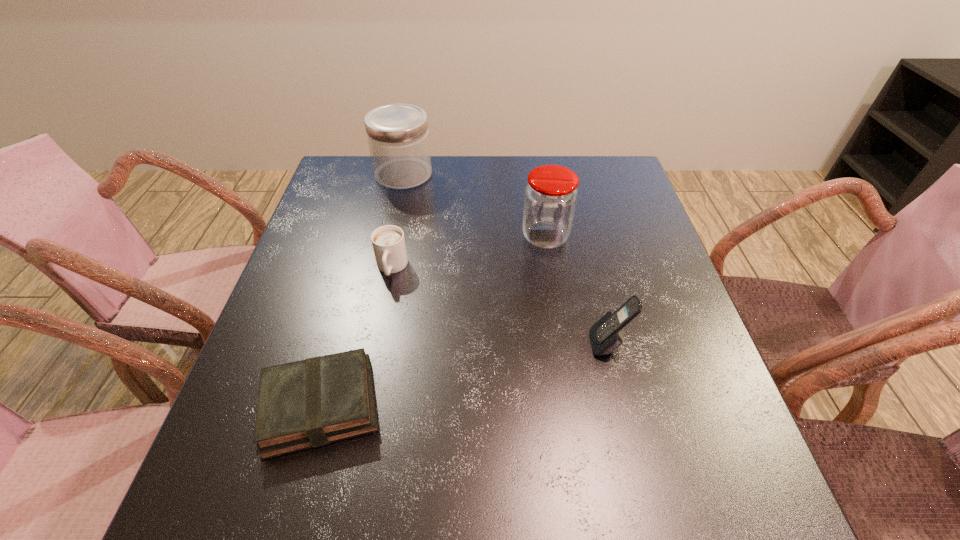
At what (x,y) coordinates should I click in order to perform the action: click on vacant point located between the shortest object and the right jar. Please return your answer as a coordinate pair (x, y). Image resolution: width=960 pixels, height=540 pixels. Looking at the image, I should click on (433, 321).

Locate an element on the screen. empty location between the farther jar and the cellular telephone is located at coordinates (506, 259).

Locate an element on the screen. unoccupied area between the fourth tallest object and the right jar is located at coordinates (468, 253).

At what (x,y) coordinates should I click in order to perform the action: click on free space between the shortest object and the cappuccino. Please return your answer as a coordinate pair (x, y). This screenshot has height=540, width=960. Looking at the image, I should click on pyautogui.click(x=356, y=337).

Locate an element on the screen. The width and height of the screenshot is (960, 540). free point between the nearest object and the fourth tallest object is located at coordinates (356, 337).

Image resolution: width=960 pixels, height=540 pixels. I want to click on empty space between the farthest object and the right jar, so point(474,206).

Identify the location of object that is the closest to the farthest object. The image size is (960, 540). click(388, 241).

Find the location of a particular element. This screenshot has width=960, height=540. object that is the fourth closest one to the shortest object is located at coordinates (398, 137).